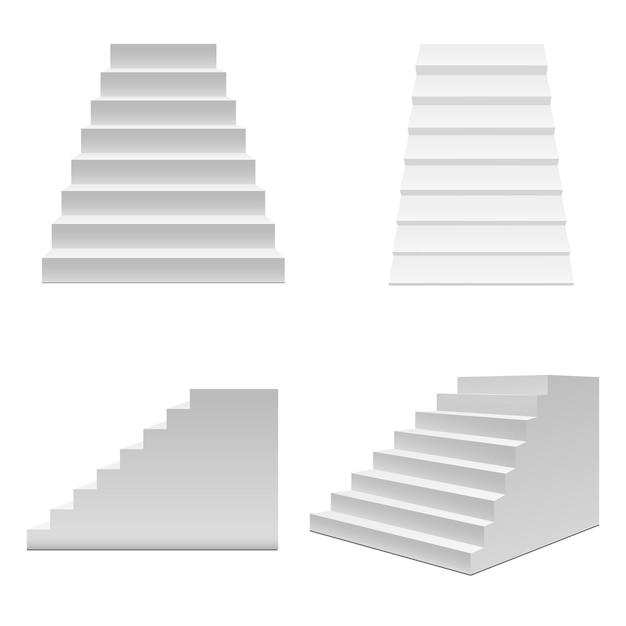
You are a GUI agent. You are given a task and a screenshot of the screen. Output one action in this format:
    pyautogui.click(x=<x>, y=<y>)
    Task: Click on the staircases
    
    Given the screenshot: What is the action you would take?
    pyautogui.click(x=168, y=168), pyautogui.click(x=491, y=175), pyautogui.click(x=154, y=464), pyautogui.click(x=471, y=446)